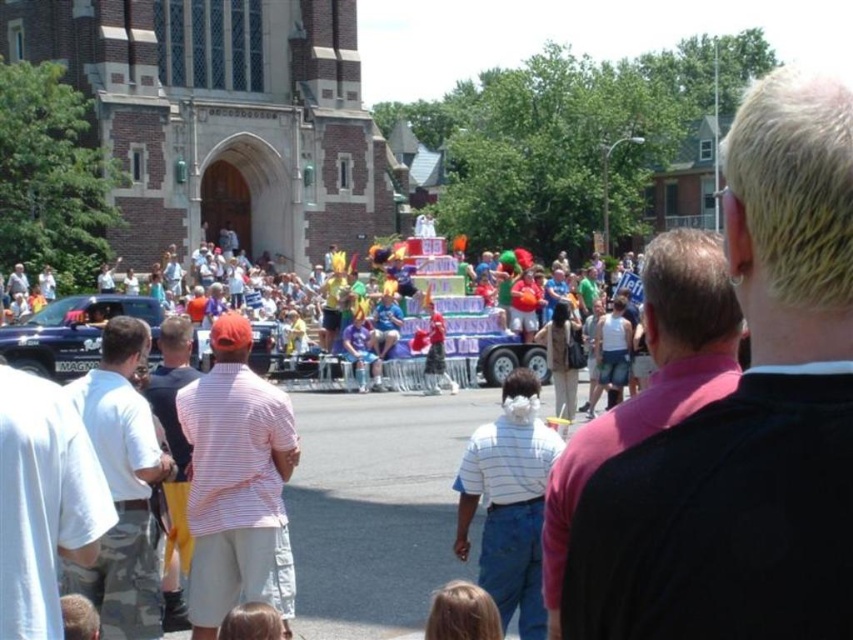
You are a photographer trying to capture both the pink fabric shirt at upper right and the striped cotton shirt at center in a single frame. Based on their heights, which shirt will appear larger in your photo?

The pink fabric shirt at upper right will appear larger in the photo because it is taller than the striped cotton shirt at center.

You are a photographer standing in the crowd at the parade. You want to take a picture of the striped cotton shirt at center and the multicolored balloons at center. Which object should you focus on first to ensure both are in the frame?

The striped cotton shirt at center is below the multicolored balloons at center, so you should focus on the striped cotton shirt at center first to ensure both are in the frame.

You are a photographer trying to capture the entire float and the crowd in one shot. The multicolored balloons at center and the striped cotton shirt at center are both in your frame. Based on their sizes in the image, which object would require you to adjust your camera angle more to ensure both are fully visible?

The multicolored balloons at center might be wider than striped cotton shirt at center, so you might need to adjust your camera angle more to accommodate the width of the multicolored balloons at center to ensure both are fully visible.